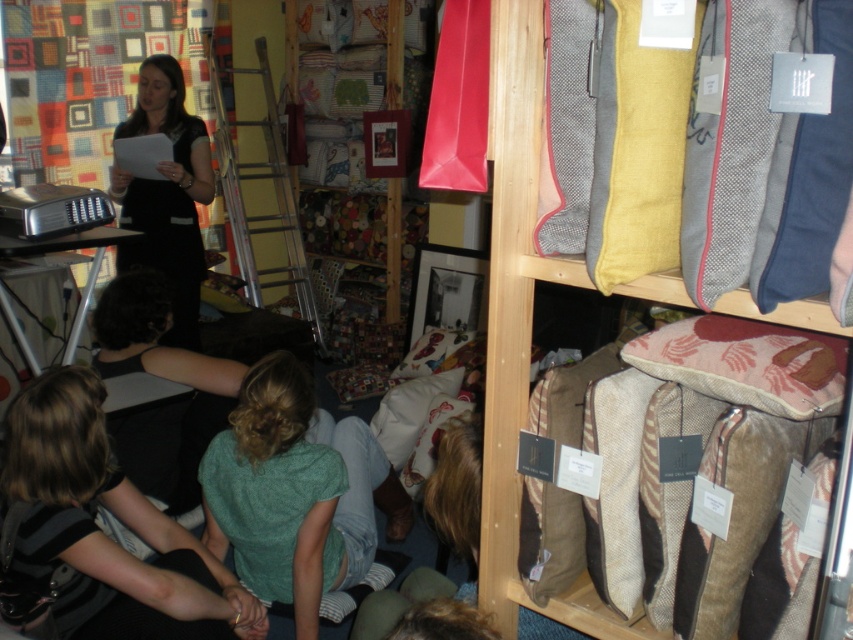
Question: Among these objects, which one is farthest from the camera?

Choices:
 (A) black dress at upper left
 (B) textured woolen cushion at upper right
 (C) pink fabric pillow at lower right
 (D) green cotton shirt at lower center

Answer: (A)

Question: Considering the relative positions of blonde hair at lower left and black dress at upper left in the image provided, where is blonde hair at lower left located with respect to black dress at upper left?

Choices:
 (A) above
 (B) below

Answer: (B)

Question: Which object appears closest to the camera in this image?

Choices:
 (A) pink fabric pillow at lower right
 (B) black dress at upper left
 (C) green cotton shirt at lower center
 (D) textured woolen cushion at upper right

Answer: (D)

Question: Is blonde hair at lower left to the left of textured woolen cushion at upper right from the viewer's perspective?

Choices:
 (A) no
 (B) yes

Answer: (B)

Question: Which point is farther to the camera?

Choices:
 (A) textured woolen cushion at upper right
 (B) black dress at upper left

Answer: (B)

Question: Does blonde hair at lower left appear on the right side of pink fabric pillow at lower right?

Choices:
 (A) no
 (B) yes

Answer: (A)